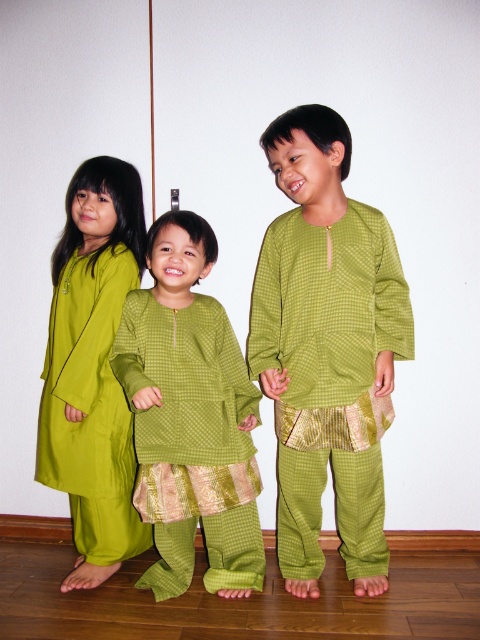
Is green textured kurta at center thinner than matte green dress at left?

No.

Which is more to the right, green textured kurta at center or matte green dress at left?

Positioned to the right is green textured kurta at center.

Which is behind, point (183, 406) or point (140, 259)?

Point (140, 259)

Identify the location of green textured kurta at center. 191,412.

Does green checkered shirt at center lie behind matte green dress at left?

No, it is in front of matte green dress at left.

Can you confirm if green checkered shirt at center is thinner than matte green dress at left?

Incorrect, green checkered shirt at center's width is not less than matte green dress at left's.

Locate an element on the screen. green checkered shirt at center is located at coordinates (326, 349).

The image size is (480, 640). I want to click on green checkered shirt at center, so click(326, 349).

This screenshot has width=480, height=640. What do you see at coordinates (326, 349) in the screenshot? I see `green checkered shirt at center` at bounding box center [326, 349].

Can you confirm if green checkered shirt at center is bigger than green textured kurta at center?

Yes, green checkered shirt at center is bigger than green textured kurta at center.

Is point (324, 200) positioned before point (167, 276)?

Yes, it is in front of point (167, 276).

Identify the location of green checkered shirt at center. The image size is (480, 640). click(x=326, y=349).